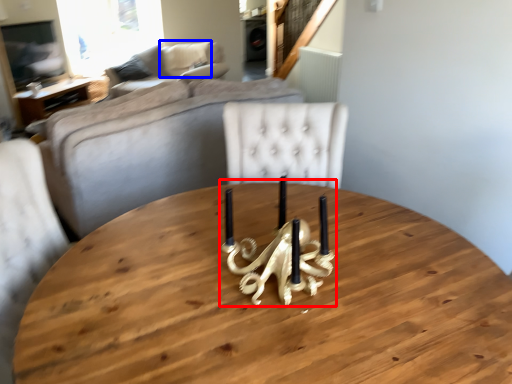
Question: Which point is closer to the camera, candle holder (highlighted by a red box) or pillow (highlighted by a blue box)?

Choices:
 (A) candle holder
 (B) pillow

Answer: (A)